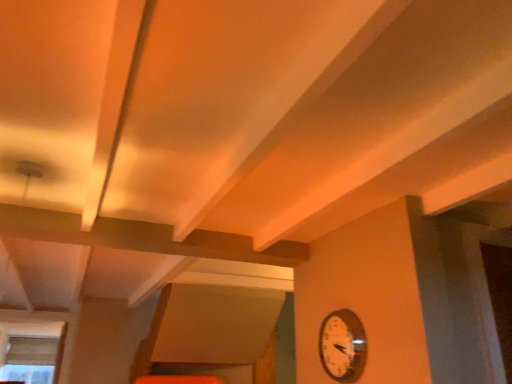
Question: Is point (335, 342) positioned closer to the camera than point (26, 382)?

Choices:
 (A) closer
 (B) farther

Answer: (A)

Question: Is metallic silver clock at lower right inside or outside of clear glass window at lower left?

Choices:
 (A) outside
 (B) inside

Answer: (A)

Question: Is metallic silver clock at lower right taller or shorter than clear glass window at lower left?

Choices:
 (A) short
 (B) tall

Answer: (A)

Question: Considering the positions of clear glass window at lower left and metallic silver clock at lower right in the image, is clear glass window at lower left taller or shorter than metallic silver clock at lower right?

Choices:
 (A) short
 (B) tall

Answer: (B)

Question: Relative to metallic silver clock at lower right, is clear glass window at lower left in front or behind?

Choices:
 (A) front
 (B) behind

Answer: (B)

Question: Is clear glass window at lower left inside or outside of metallic silver clock at lower right?

Choices:
 (A) outside
 (B) inside

Answer: (A)

Question: Is clear glass window at lower left wider or thinner than metallic silver clock at lower right?

Choices:
 (A) wide
 (B) thin

Answer: (A)